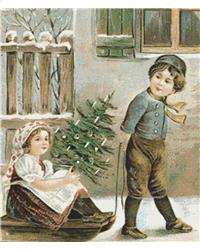
In order to click on christmas tree in this screenshot , I will do `click(107, 106)`, `click(92, 107)`, `click(101, 121)`, `click(80, 134)`, `click(89, 158)`, `click(85, 115)`, `click(68, 161)`, `click(70, 149)`.